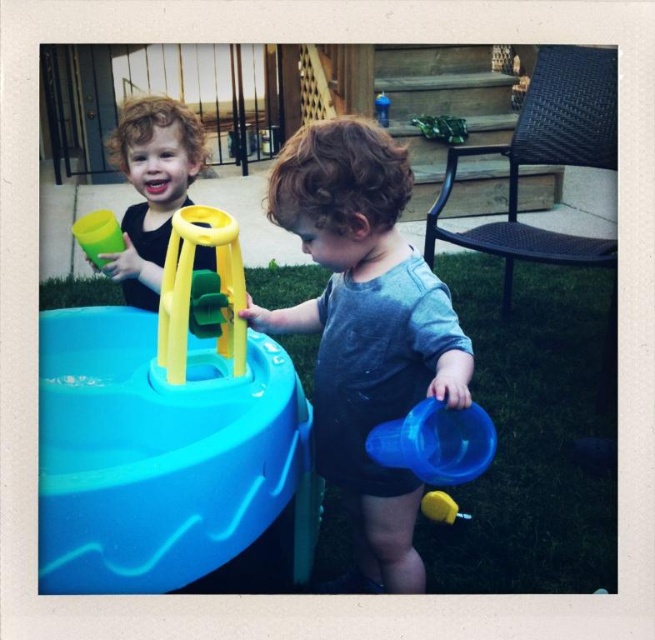
You are a delivery robot that is 1.5 meters wide. You need to deliver a package to the house through the stairs. There are two children playing near the stairs. The first child is at point (174, 136) and the second child is at another location. The distance between them is 1.86 meters. Can you safely pass between the two children without hitting either?

The two children are 1.86 meters apart, so the delivery robot which is 1.5 meters wide can safely pass between them as the distance between the children is greater than the robot width.

You are standing in the scene and want to walk from point A to point B. Point A is located at coordinates point (69, 355) and point B is at point (328, 385). Which point is closer to you?

Point A at point (69, 355) is closer to you because it is further to the viewer than point B at point (328, 385).

You are a parent trying to ensure the children can play safely. The water table needs to be at least 12 inches away from any clothing items to prevent water damage. Are the matte plastic water table at center and the gray matte shirt at center positioned safely?

The distance between the matte plastic water table at center and the gray matte shirt at center is 8.72 inches, which is less than the required 12 inches. Therefore, they are not positioned safely to prevent water damage.